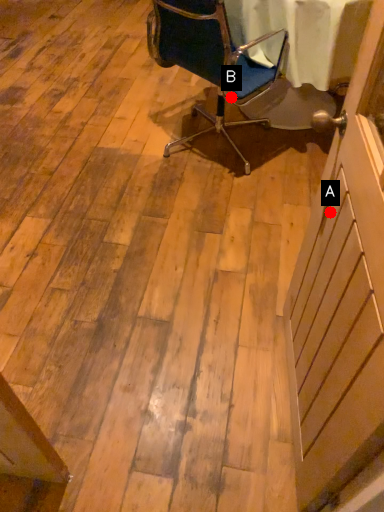
Question: Two points are circled on the image, labeled by A and B beside each circle. Which point appears closest to the camera in this image?

Choices:
 (A) A is closer
 (B) B is closer

Answer: (A)